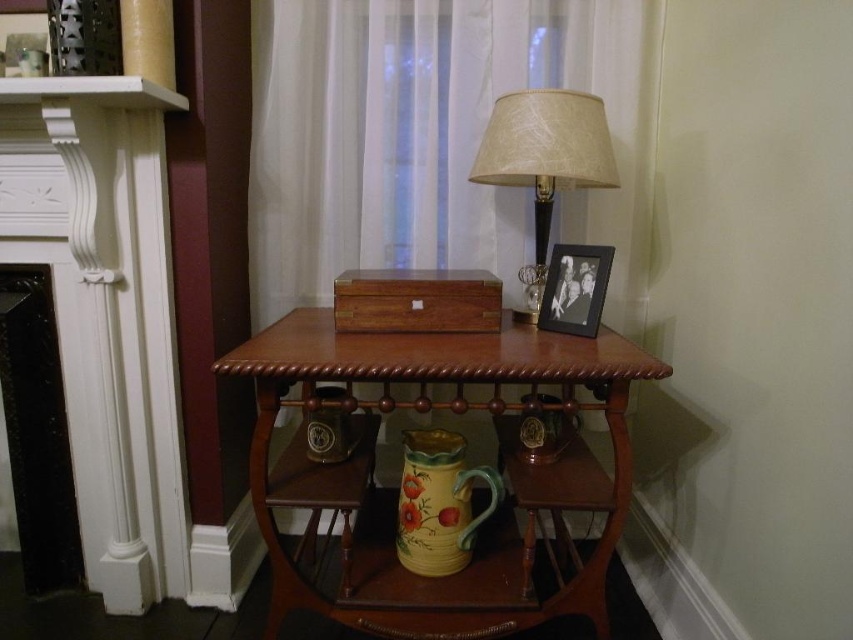
Describe the element at coordinates (434, 138) in the screenshot. I see `sheer white curtain at upper center` at that location.

Who is positioned more to the left, sheer white curtain at upper center or beige fabric lampshade at upper right?

From the viewer's perspective, sheer white curtain at upper center appears more on the left side.

Describe the element at coordinates (434, 138) in the screenshot. This screenshot has width=853, height=640. I see `sheer white curtain at upper center` at that location.

The width and height of the screenshot is (853, 640). In order to click on sheer white curtain at upper center in this screenshot , I will do `click(434, 138)`.

Which is behind, point (321, 500) or point (103, 102)?

The point (103, 102) is more distant.

Does point (325, 464) come closer to viewer compared to point (77, 77)?

No, (325, 464) is further to viewer.

Which is in front, point (341, 497) or point (103, 77)?

Point (103, 77) is in front.

Find the location of a particular element. matte ceramic vase at center is located at coordinates (326, 488).

Who is taller, sheer white curtain at upper center or mahogany wood table at center?

With more height is sheer white curtain at upper center.

Is sheer white curtain at upper center positioned at the back of mahogany wood table at center?

Yes, it is.

Between point (363, 68) and point (601, 376), which one is positioned behind?

The point (363, 68) is behind.

Locate an element on the screen. This screenshot has width=853, height=640. sheer white curtain at upper center is located at coordinates (434, 138).